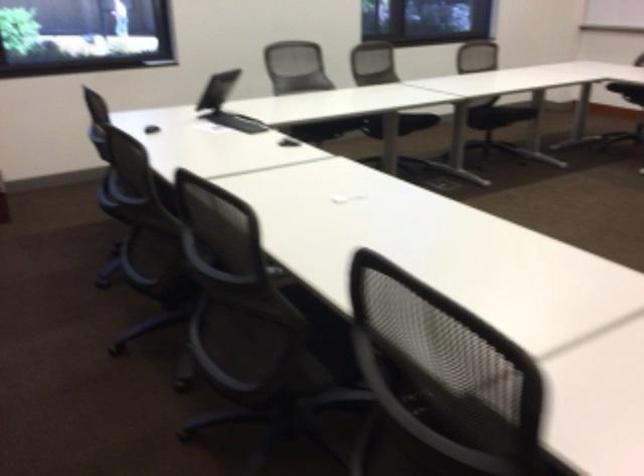
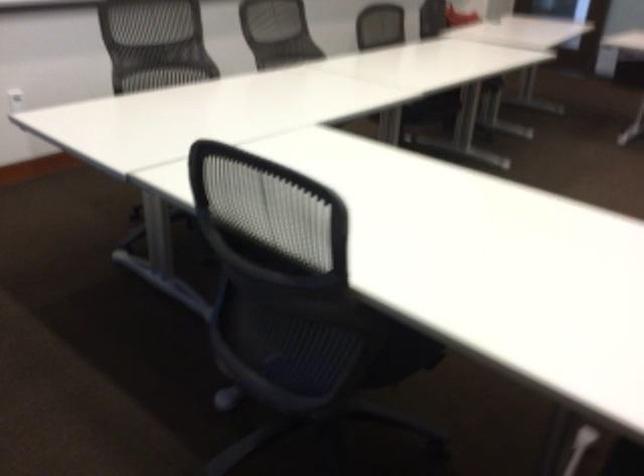
The images are taken continuously from a first-person perspective. In which direction is your viewpoint rotating?

The rotation direction of the camera is right-down.